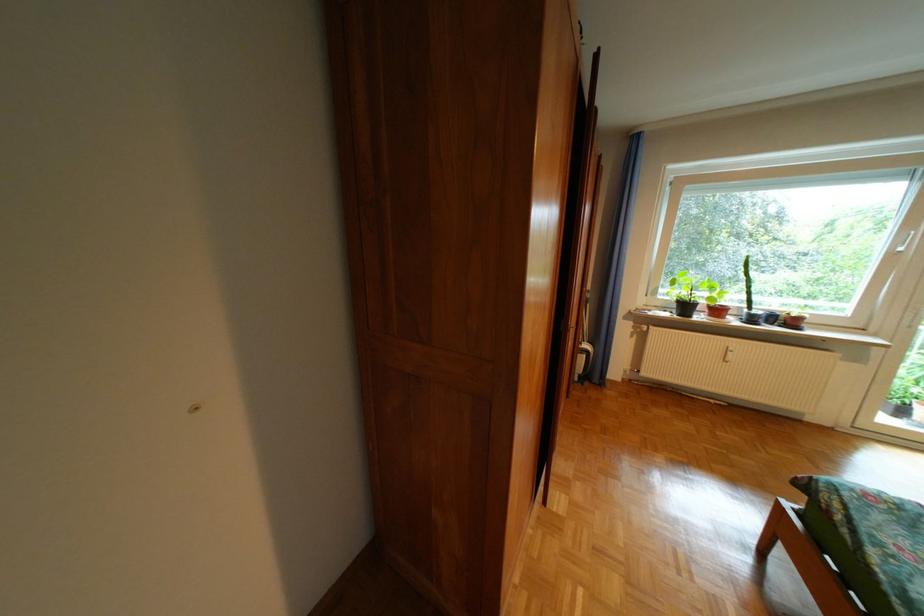
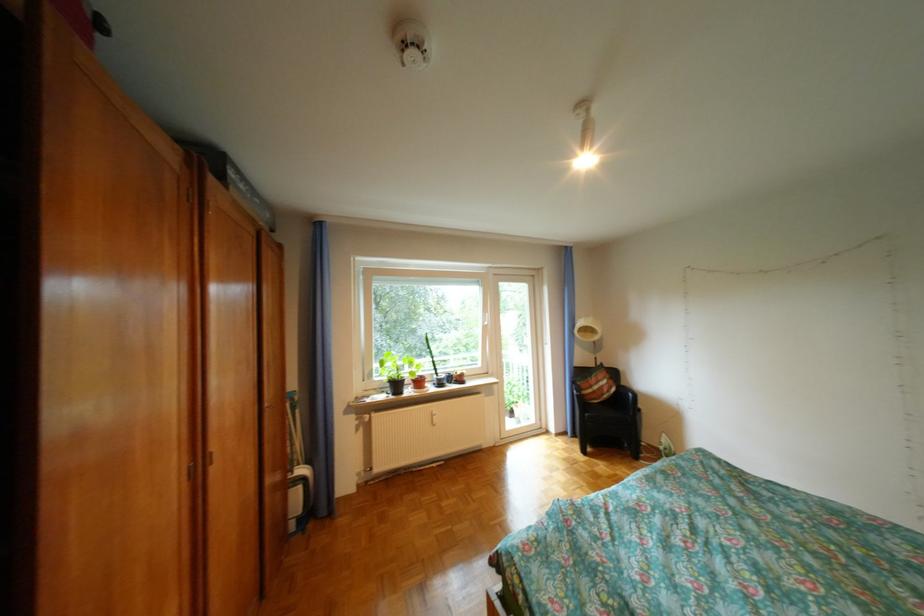
The point at (699,307) is marked in the first image. Where is the corresponding point in the second image?

(410, 386)